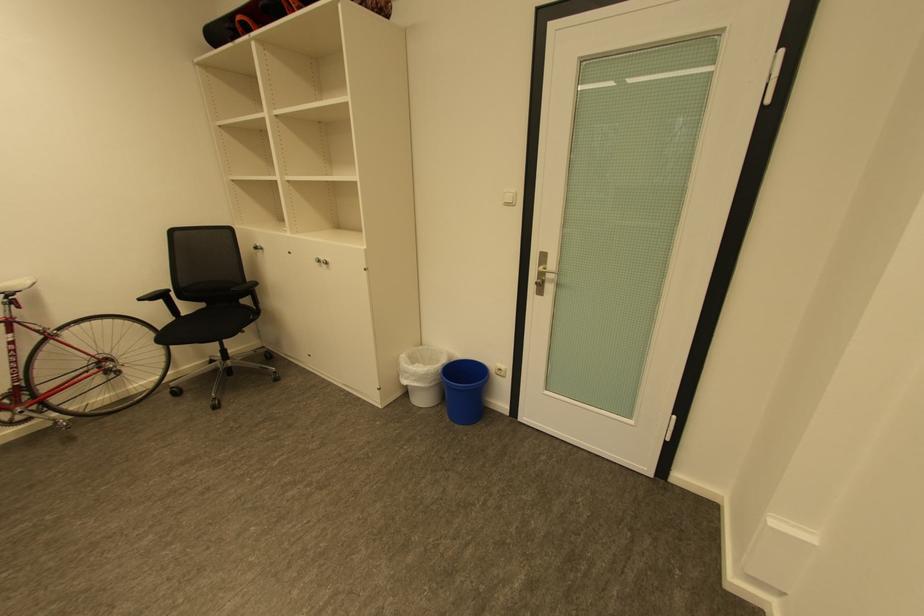
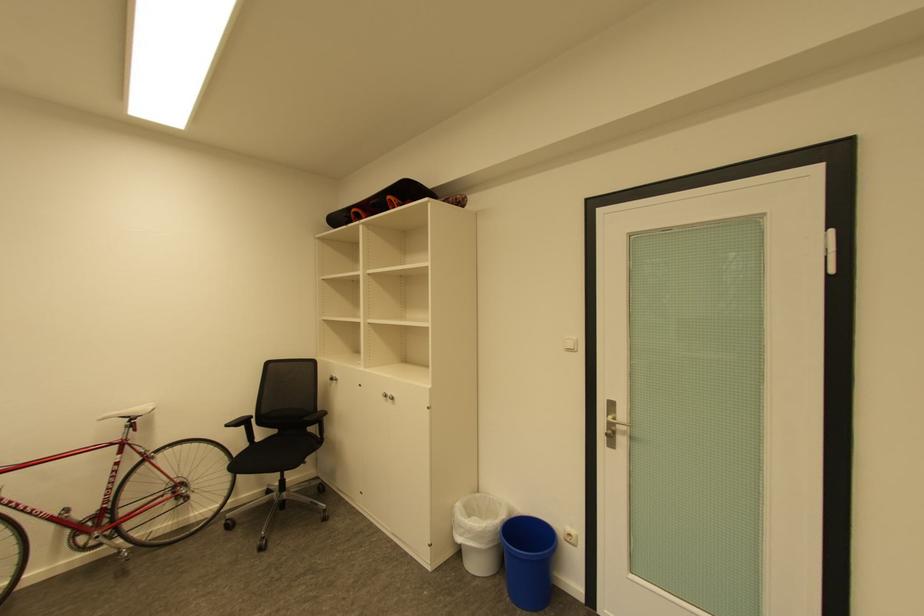
Question: The first image is from the beginning of the video and the second image is from the end. How did the camera likely rotate when shooting the video?

Choices:
 (A) Left
 (B) Right
 (C) Up
 (D) Down

Answer: (C)